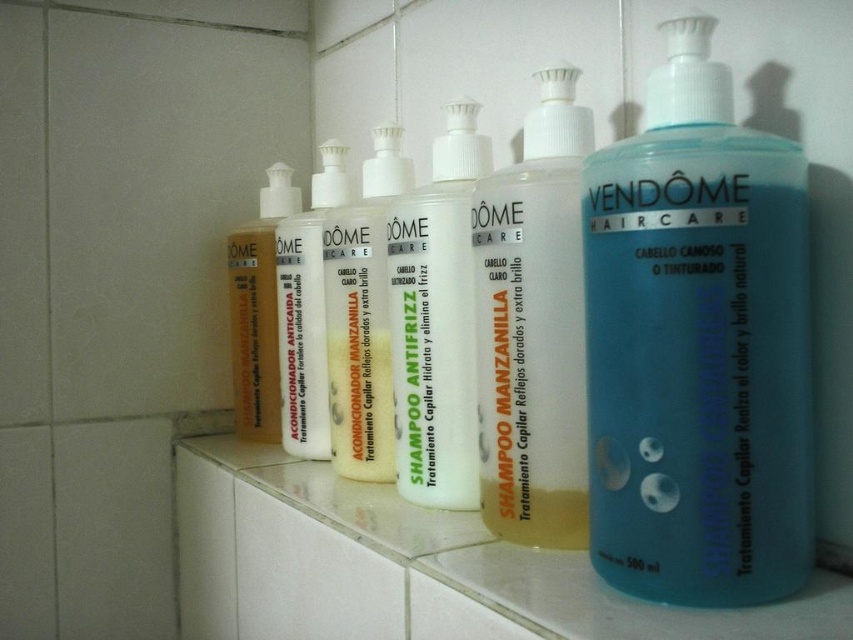
You are standing in front of the shelf and want to reach the white opaque plastic shampoo bottle at center. If your hand can extend 60 centimeters forward, can you reach it?

The distance between you and the white opaque plastic shampoo bottle at center is 62.53 centimeters. Since your hand can only extend 60 centimeters, you cannot reach it.

You are organizing a beauty counter and need to place a new product between the blue translucent shampoo at center and the white opaque plastic shampoo bottle at center. Which side should the new product be placed to maintain the height order from tallest to shortest?

The blue translucent shampoo at center is taller than the white opaque plastic shampoo bottle at center. To maintain the height order from tallest to shortest, the new product should be placed to the right of the blue translucent shampoo at center and to the left of the white opaque plastic shampoo bottle at center, ensuring the tallest is first followed by the shorter one.

You are organizing a beauty counter and see the translucent plastic shampoo at center and the white matte conditioner at center. Which one is positioned to the right side of the other?

The translucent plastic shampoo at center is positioned to the right of the white matte conditioner at center.